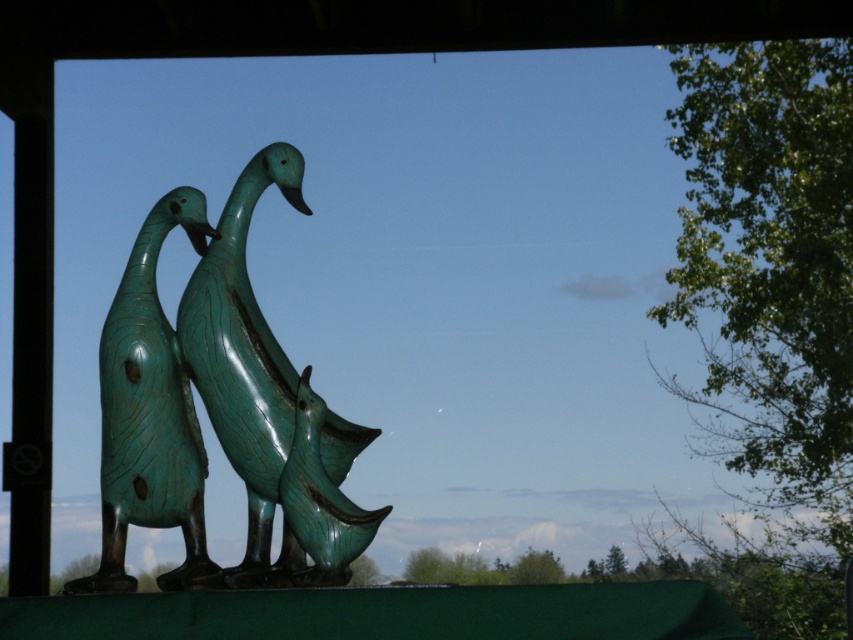
Question: Which point is closer to the camera taking this photo?

Choices:
 (A) (289, 417)
 (B) (161, 436)
 (C) (300, 388)

Answer: (C)

Question: Which object is the farthest from the green patina sculpture at center?

Choices:
 (A) green patinated bronze ducks at left
 (B) green patinated wood duck at center

Answer: (A)

Question: Does green patina sculpture at center have a larger size compared to green patinated bronze ducks at left?

Choices:
 (A) yes
 (B) no

Answer: (A)

Question: Where is green patina sculpture at center located in relation to green patinated wood duck at center in the image?

Choices:
 (A) above
 (B) below

Answer: (A)

Question: Does green patinated bronze ducks at left appear on the left side of green patinated wood duck at center?

Choices:
 (A) yes
 (B) no

Answer: (A)

Question: Which point is farther to the camera?

Choices:
 (A) (300, 513)
 (B) (146, 284)
 (C) (228, 433)

Answer: (B)